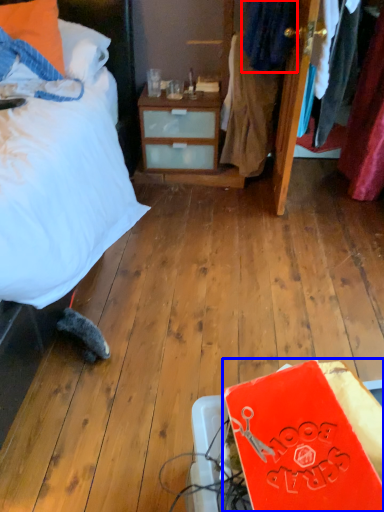
Question: Which point is further to the camera, clothing (highlighted by a red box) or book (highlighted by a blue box)?

Choices:
 (A) clothing
 (B) book

Answer: (A)